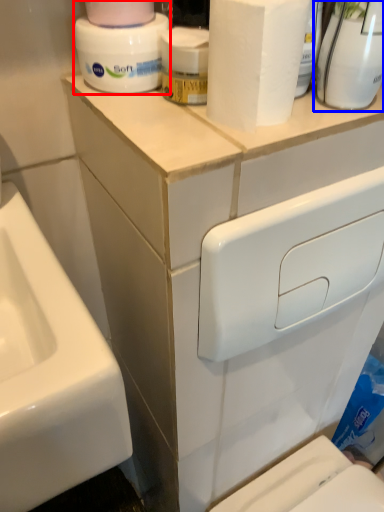
Question: Which object is further to the camera taking this photo, cleaning product (highlighted by a red box) or cleaning product (highlighted by a blue box)?

Choices:
 (A) cleaning product
 (B) cleaning product

Answer: (A)